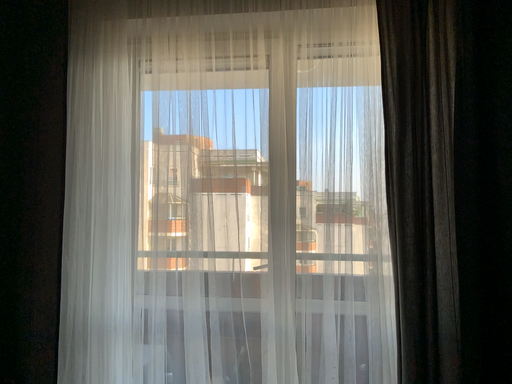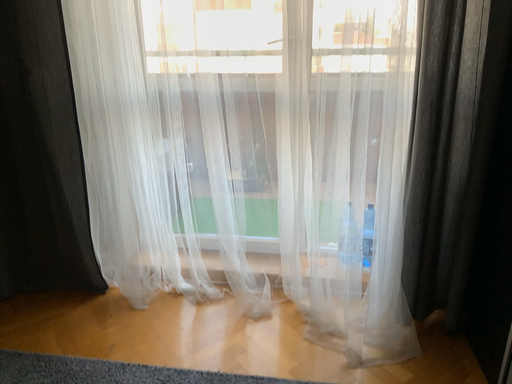
Question: Which way did the camera rotate in the video?

Choices:
 (A) rotated downward
 (B) rotated upward

Answer: (A)